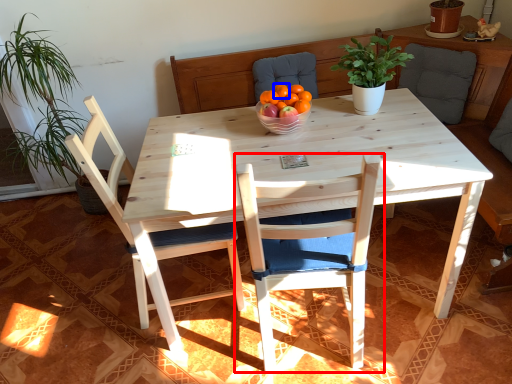
Question: Among these objects, which one is nearest to the camera, chair (highlighted by a red box) or tangerine (highlighted by a blue box)?

Choices:
 (A) chair
 (B) tangerine

Answer: (A)